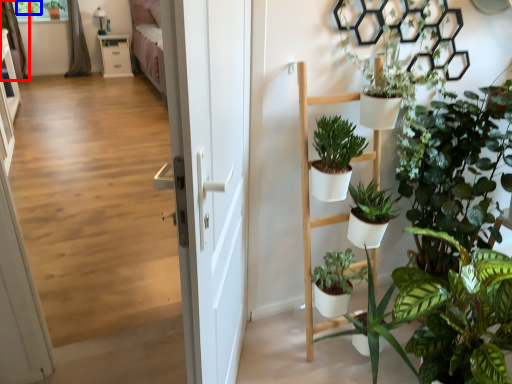
Question: Which point is further to the camera, curtain (highlighted by a red box) or plant (highlighted by a blue box)?

Choices:
 (A) curtain
 (B) plant

Answer: (B)